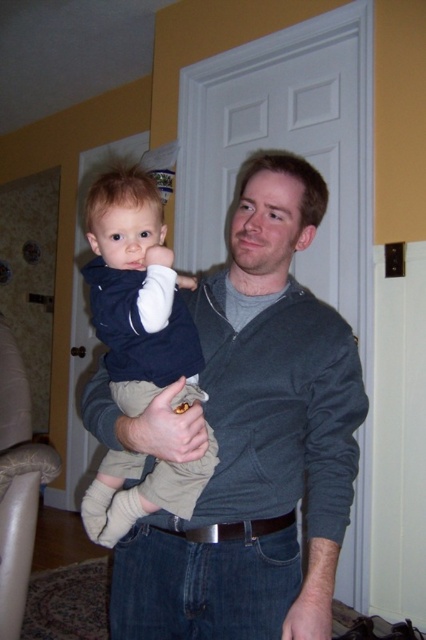
Question: Based on their relative distances, which object is farther from the dark gray corduroy sleeve at center?

Choices:
 (A) matte blue shirt at center
 (B) dark gray sweater at center

Answer: (A)

Question: Does dark gray sweater at center appear on the right side of dark gray corduroy sleeve at center?

Choices:
 (A) yes
 (B) no

Answer: (B)

Question: Does dark gray sweater at center appear on the left side of dark gray corduroy sleeve at center?

Choices:
 (A) yes
 (B) no

Answer: (A)

Question: Among these points, which one is nearest to the camera?

Choices:
 (A) (305, 506)
 (B) (154, 276)
 (C) (345, 461)

Answer: (B)

Question: Which of the following is the closest to the observer?

Choices:
 (A) matte blue shirt at center
 (B) dark gray sweater at center

Answer: (B)

Question: Does dark gray sweater at center come in front of dark gray corduroy sleeve at center?

Choices:
 (A) no
 (B) yes

Answer: (A)